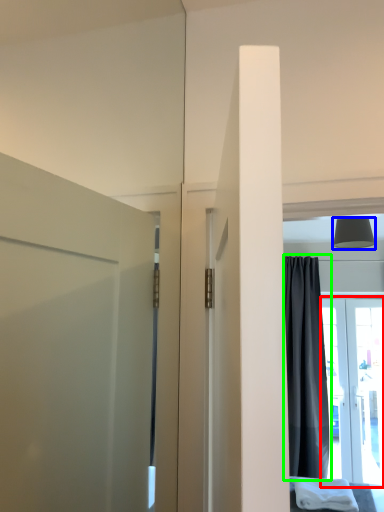
Question: Which is nearer to the door (highlighted by a red box)? lamp (highlighted by a blue box) or curtain (highlighted by a green box).

Choices:
 (A) lamp
 (B) curtain

Answer: (B)